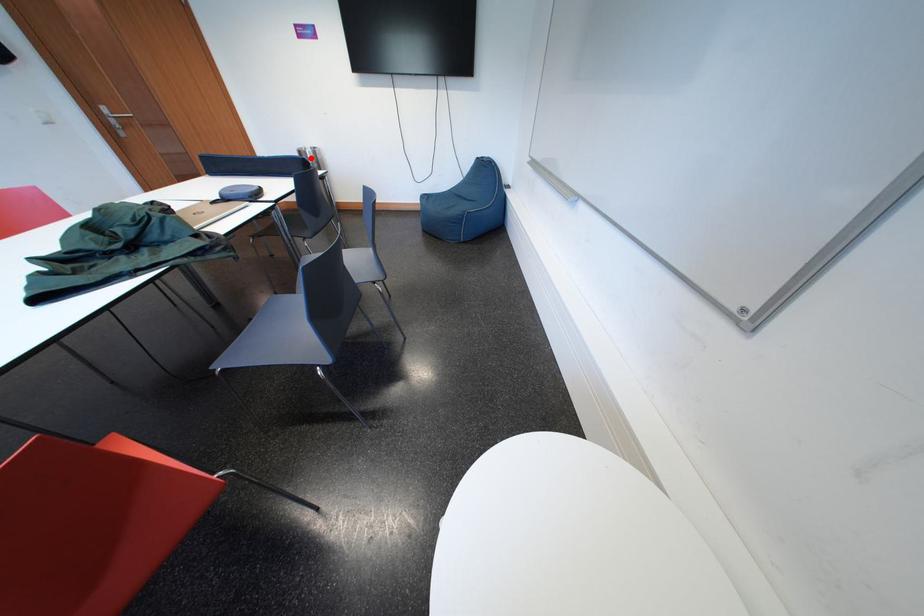
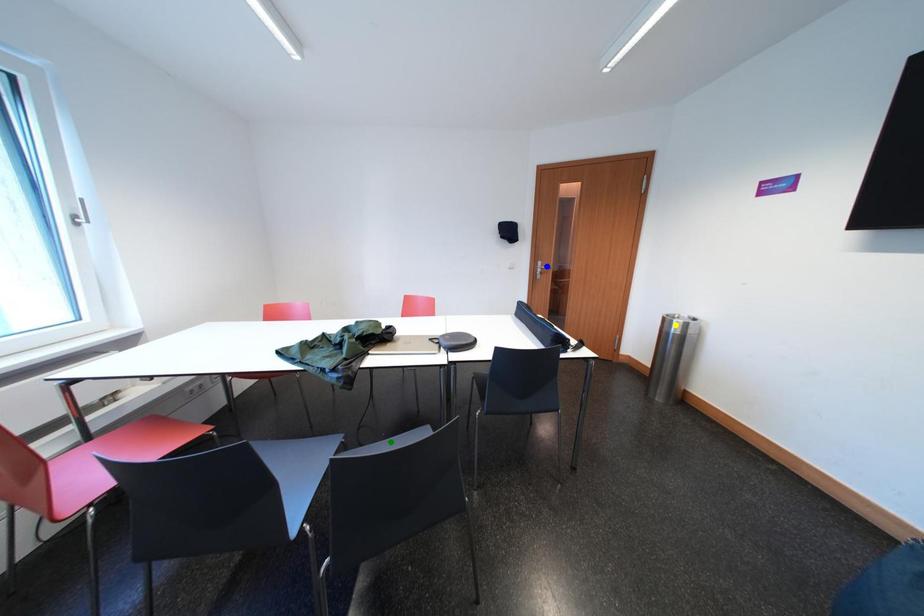
Question: I am providing you with two images of the same scene from different viewpoints. A red point is marked on the first image. You are given multiple points on the second image. In image 2, which mark is for the same physical point as the one in image 1?

Choices:
 (A) yellow point
 (B) green point
 (C) blue point

Answer: (A)